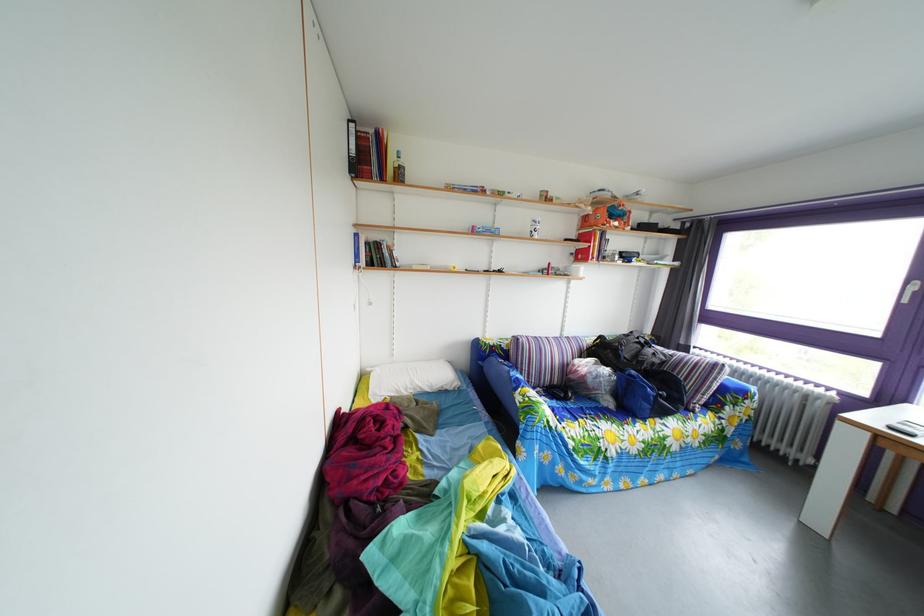
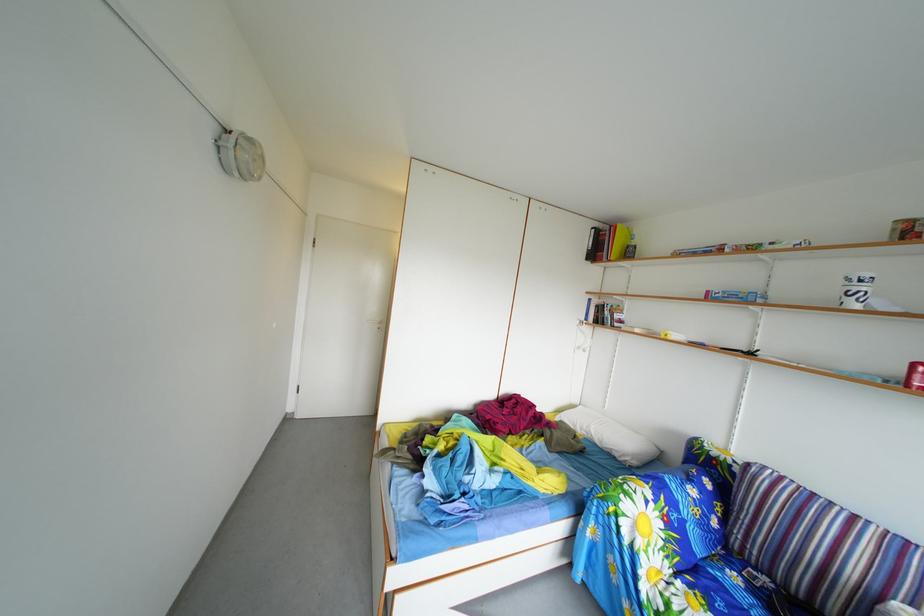
Find the pixel in the second image that matches (x=442, y=395) in the first image.

(612, 451)